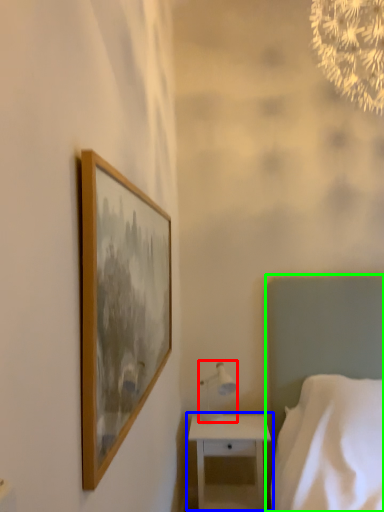
Question: Which object is positioned farthest from table lamp (highlighted by a red box)? Select from nightstand (highlighted by a blue box) and bed (highlighted by a green box).

Choices:
 (A) nightstand
 (B) bed

Answer: (B)